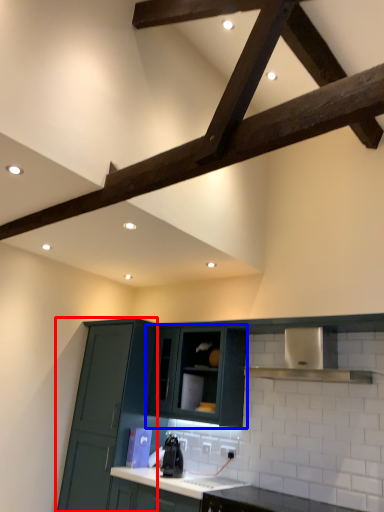
Question: Among these objects, which one is nearest to the camera, cabinetry (highlighted by a red box) or cabinetry (highlighted by a blue box)?

Choices:
 (A) cabinetry
 (B) cabinetry

Answer: (A)